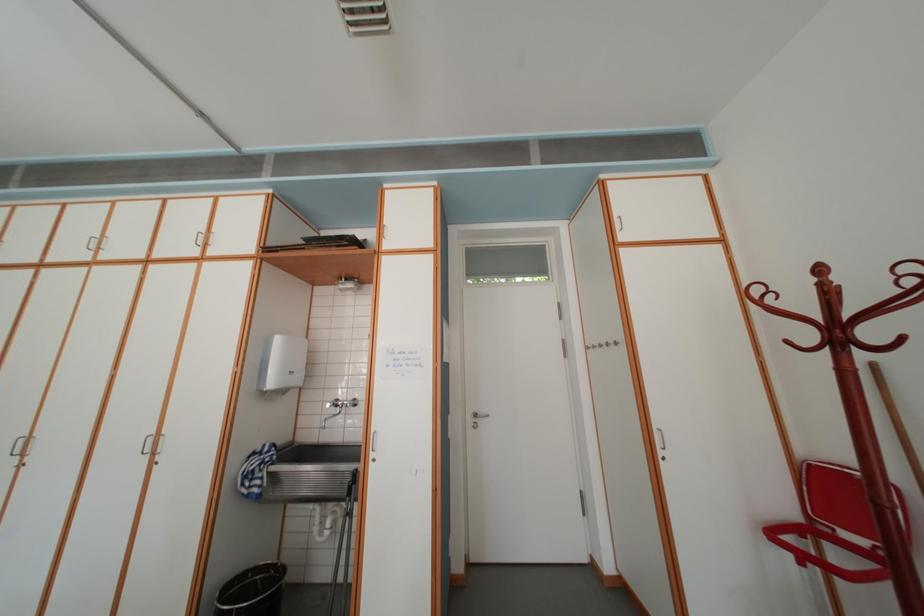
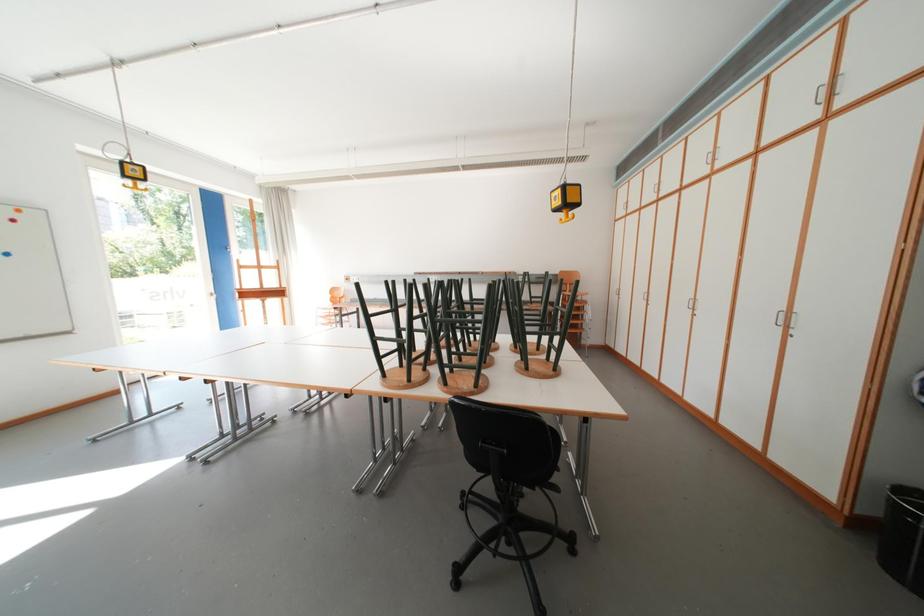
Question: The camera is either moving clockwise (left) or counter-clockwise (right) around the object. The first image is from the beginning of the video and the second image is from the end. Is the camera moving left or right when shooting the video?

Choices:
 (A) Left
 (B) Right

Answer: (B)